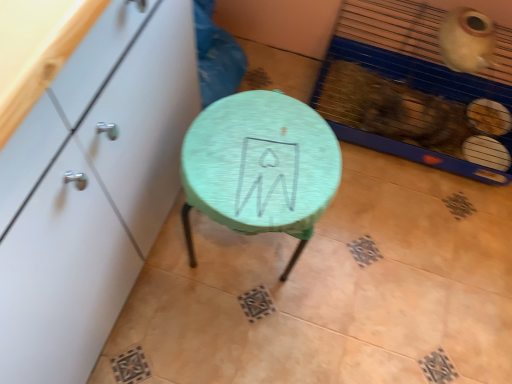
Find the location of `vacant space underneath mint green fabric stool at center (from a real-world perspective)`. vacant space underneath mint green fabric stool at center (from a real-world perspective) is located at coordinates (245, 251).